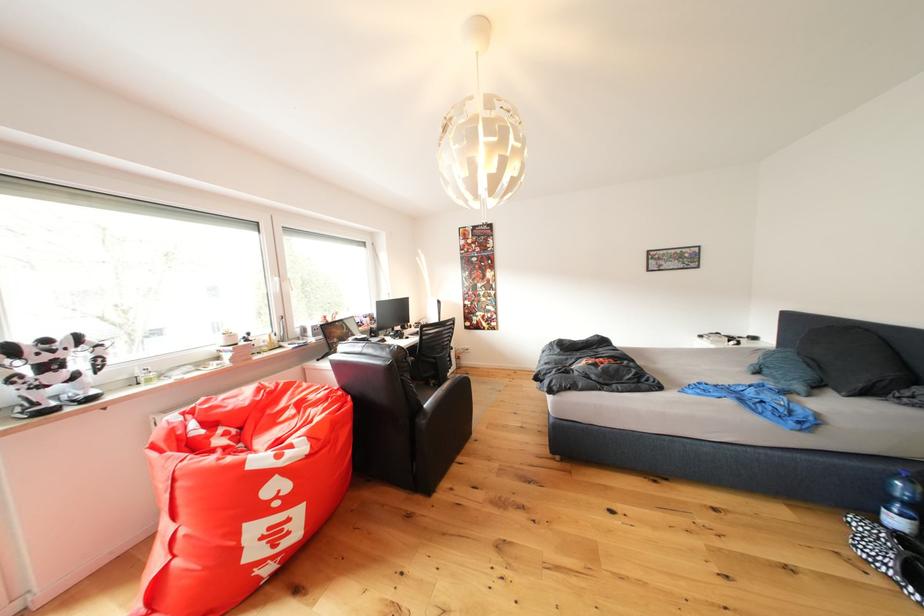
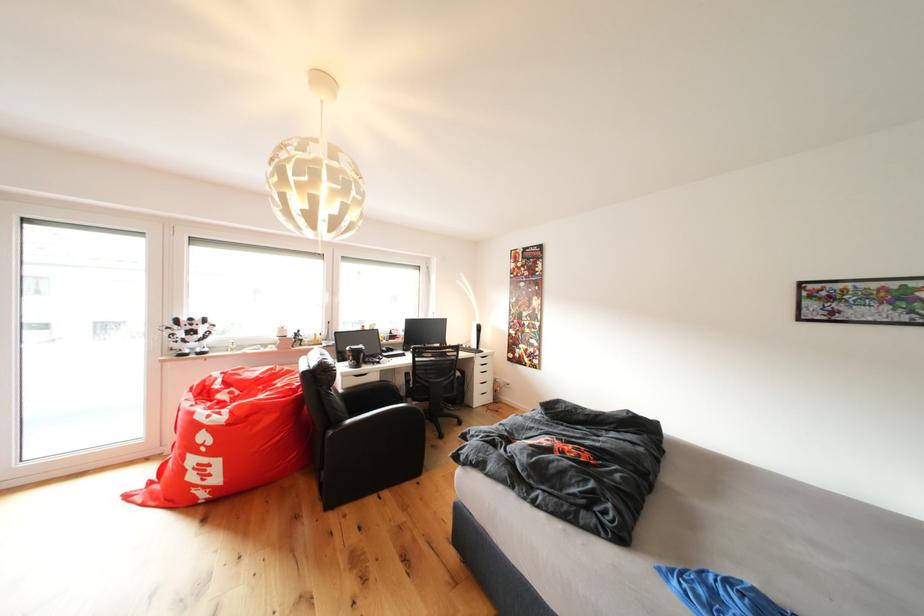
Locate, in the second image, the point that corresponds to the point at 55,346 in the first image.

(200, 323)